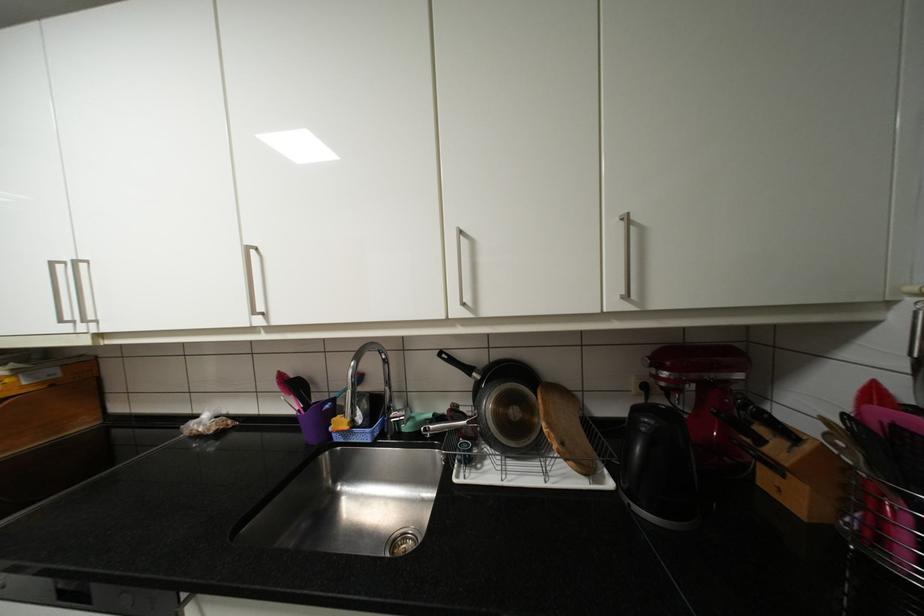
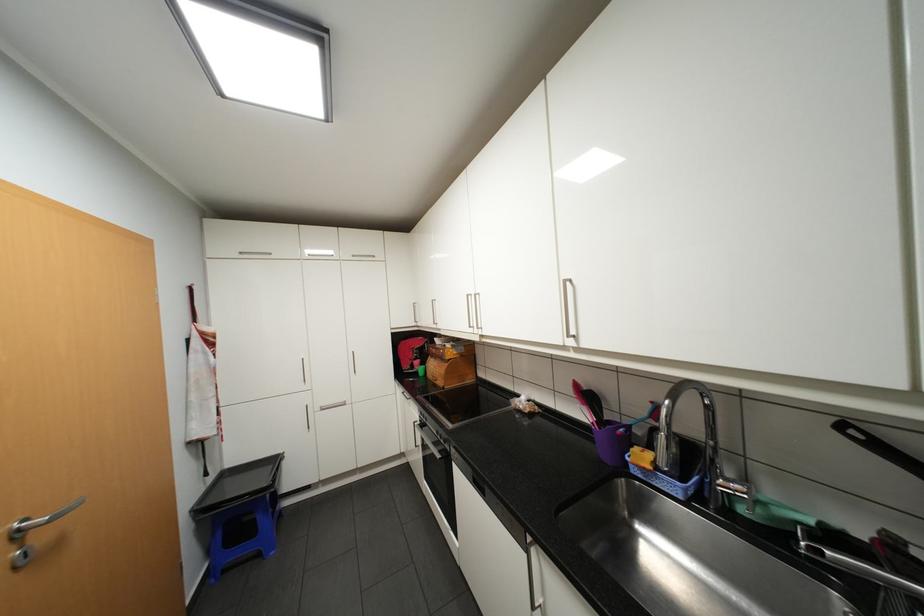
Where in the second image is the point corresponding to the point at 304,385 from the first image?

(597, 397)